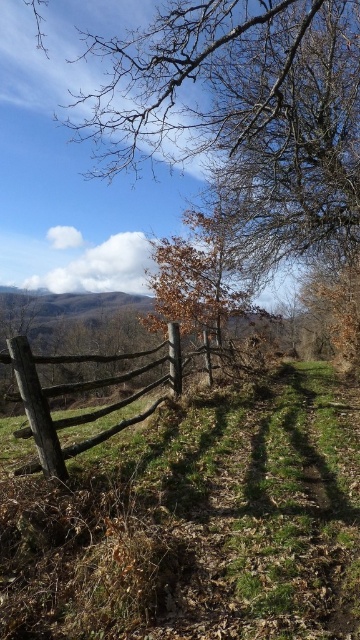
Does point (297, 228) lie behind point (189, 294)?

Yes, it is.

Does point (253, 278) lie behind point (195, 298)?

Yes, point (253, 278) is farther from viewer.

Where is `brown wood tree at upper center`? This screenshot has height=640, width=360. brown wood tree at upper center is located at coordinates (245, 125).

Does point (178, 246) lie in front of point (88, 355)?

That is False.

Does point (198, 220) lie behind point (155, 364)?

Yes, point (198, 220) is farther from viewer.

Is point (221, 333) in front of point (61, 474)?

No.

This screenshot has width=360, height=640. I want to click on brown matte tree at center, so click(x=196, y=284).

Is brown wood tree at upper center bigger than rustic wooden fence at center?

Correct, brown wood tree at upper center is larger in size than rustic wooden fence at center.

Can you confirm if brown wood tree at upper center is positioned to the right of rustic wooden fence at center?

Yes, brown wood tree at upper center is to the right of rustic wooden fence at center.

Is point (219, 225) farther from viewer compared to point (104, 381)?

Yes, point (219, 225) is farther from viewer.

Identify the location of brown wood tree at upper center. (245, 125).